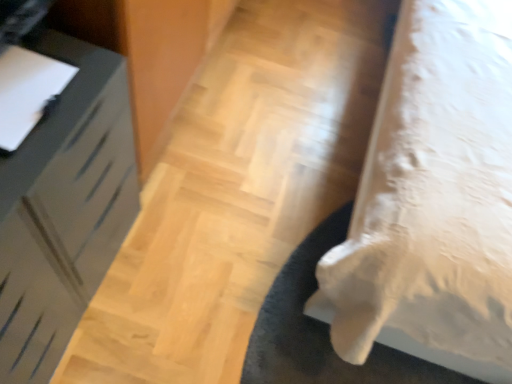
Question: Can you confirm if white glossy drawer at left, the 1th furniture viewed from the left, is positioned to the left of white fabric bed at lower right, the second furniture positioned from the left?

Choices:
 (A) no
 (B) yes

Answer: (B)

Question: Is white glossy drawer at left, the 1th furniture viewed from the left, next to white fabric bed at lower right, the second furniture positioned from the left?

Choices:
 (A) no
 (B) yes

Answer: (A)

Question: Considering the relative sizes of white glossy drawer at left, which ranks as the 2th furniture in right-to-left order, and white fabric bed at lower right, the second furniture positioned from the left, in the image provided, is white glossy drawer at left, which ranks as the 2th furniture in right-to-left order, bigger than white fabric bed at lower right, the second furniture positioned from the left,?

Choices:
 (A) no
 (B) yes

Answer: (A)

Question: Does white glossy drawer at left, the 1th furniture viewed from the left, lie in front of white fabric bed at lower right, the second furniture positioned from the left?

Choices:
 (A) no
 (B) yes

Answer: (A)

Question: From a real-world perspective, is white glossy drawer at left, which ranks as the 2th furniture in right-to-left order, located higher than white fabric bed at lower right, the second furniture positioned from the left?

Choices:
 (A) no
 (B) yes

Answer: (A)

Question: From the image's perspective, does white glossy drawer at left, the 1th furniture viewed from the left, appear lower than white fabric bed at lower right, arranged as the first furniture when viewed from the right?

Choices:
 (A) yes
 (B) no

Answer: (A)

Question: Does black fuzzy mat at lower right lie behind white glossy drawer at left, which ranks as the 2th furniture in right-to-left order?

Choices:
 (A) yes
 (B) no

Answer: (A)

Question: Is black fuzzy mat at lower right next to white glossy drawer at left, the 1th furniture viewed from the left, and touching it?

Choices:
 (A) no
 (B) yes

Answer: (A)

Question: Is black fuzzy mat at lower right far from white glossy drawer at left, which ranks as the 2th furniture in right-to-left order?

Choices:
 (A) no
 (B) yes

Answer: (A)

Question: From the image's perspective, is black fuzzy mat at lower right on top of white glossy drawer at left, the 1th furniture viewed from the left?

Choices:
 (A) no
 (B) yes

Answer: (A)

Question: Considering the relative sizes of black fuzzy mat at lower right and white glossy drawer at left, the 1th furniture viewed from the left, in the image provided, is black fuzzy mat at lower right bigger than white glossy drawer at left, the 1th furniture viewed from the left,?

Choices:
 (A) no
 (B) yes

Answer: (A)

Question: Is black fuzzy mat at lower right located outside white glossy drawer at left, which ranks as the 2th furniture in right-to-left order?

Choices:
 (A) yes
 (B) no

Answer: (A)

Question: Is white fabric bed at lower right, the second furniture positioned from the left, thinner than black fuzzy mat at lower right?

Choices:
 (A) no
 (B) yes

Answer: (A)